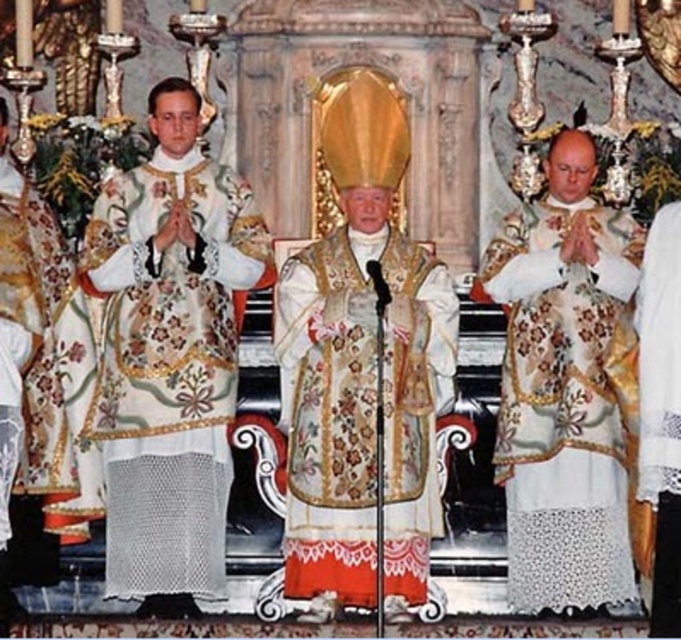
Is white embroidered robe at center positioned behind white lace robe at center?

Yes, white embroidered robe at center is behind white lace robe at center.

Locate an element on the screen. The width and height of the screenshot is (681, 640). white embroidered robe at center is located at coordinates (170, 356).

Is point (232, 225) positioned after point (516, 428)?

That is True.

Locate an element on the screen. The image size is (681, 640). white embroidered robe at center is located at coordinates (170, 356).

Does white embroidered robe at center have a smaller size compared to white lace robe at right?

Incorrect, white embroidered robe at center is not smaller in size than white lace robe at right.

Who is shorter, white embroidered robe at center or white lace robe at right?

white lace robe at right

Is point (118, 404) positioned before point (661, 324)?

That is False.

Identify the location of white embroidered robe at center. This screenshot has width=681, height=640. (170, 356).

Is white embroidered robe at left closer to camera compared to white lace robe at right?

No, white embroidered robe at left is behind white lace robe at right.

Does white embroidered robe at left have a lesser width compared to white lace robe at right?

In fact, white embroidered robe at left might be wider than white lace robe at right.

This screenshot has height=640, width=681. What do you see at coordinates (22, 337) in the screenshot?
I see `white embroidered robe at left` at bounding box center [22, 337].

This screenshot has width=681, height=640. Identify the location of white embroidered robe at left. tap(22, 337).